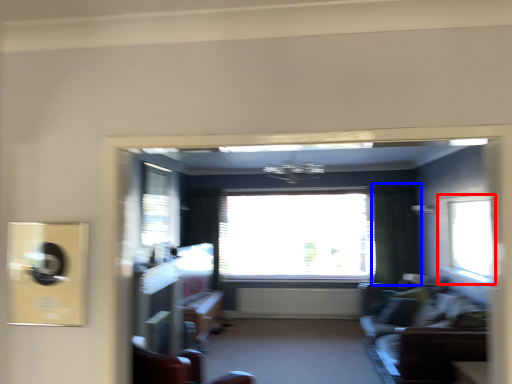
Question: Which point is closer to the camera, window (highlighted by a red box) or curtain (highlighted by a blue box)?

Choices:
 (A) window
 (B) curtain

Answer: (A)